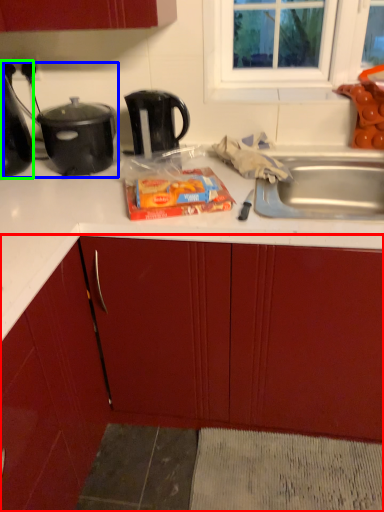
Question: Which object is positioned closest to cabinetry (highlighted by a red box)? Select from appliance (highlighted by a blue box) and kitchen appliance (highlighted by a green box).

Choices:
 (A) appliance
 (B) kitchen appliance

Answer: (A)